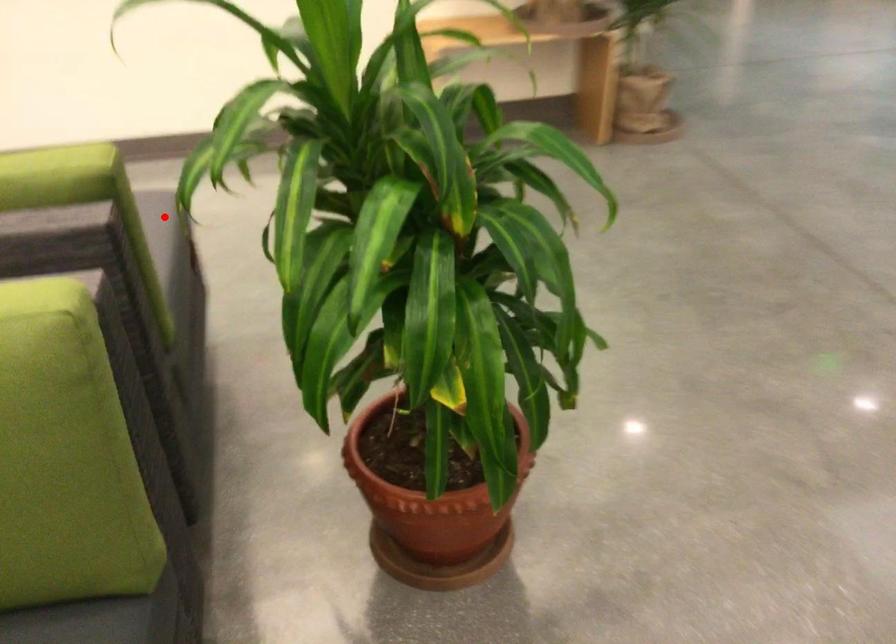
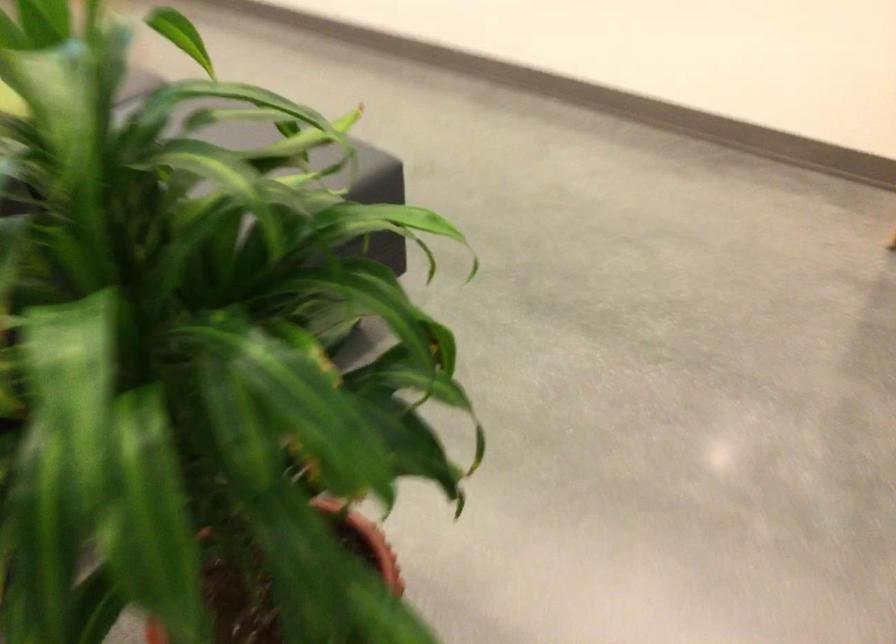
Where in the second image is the point corresponding to the highlighted location from the first image?

(367, 167)